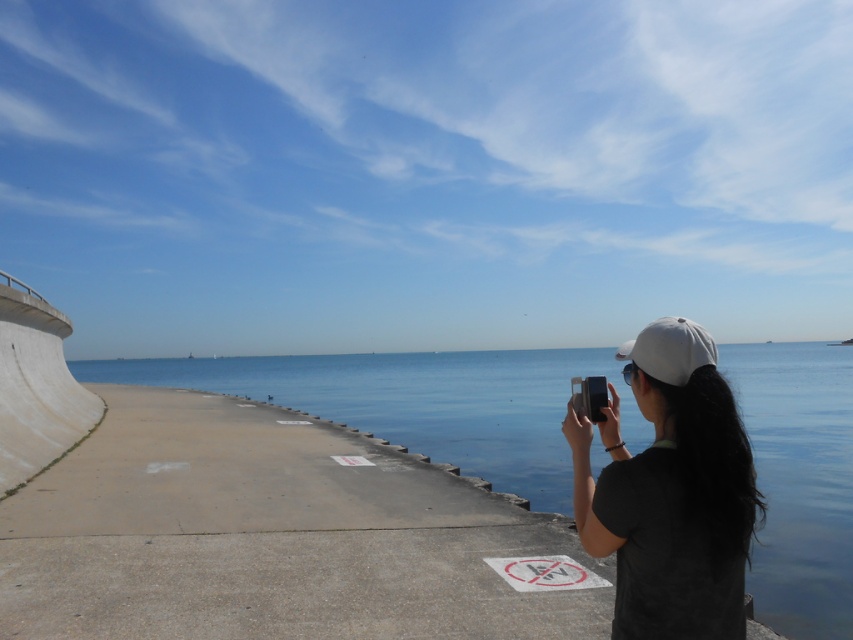
Question: Is black matte cap at upper right in front of white matte baseball hat at center?

Choices:
 (A) yes
 (B) no

Answer: (A)

Question: Does black matte cap at upper right have a lesser width compared to white matte baseball hat at center?

Choices:
 (A) no
 (B) yes

Answer: (A)

Question: Which point is farther to the camera?

Choices:
 (A) clear blue water at center
 (B) white matte baseball hat at center
 (C) black matte cap at upper right

Answer: (A)

Question: Is clear blue water at center positioned at the back of white matte baseball hat at center?

Choices:
 (A) no
 (B) yes

Answer: (B)

Question: Estimate the real-world distances between objects in this image. Which object is closer to the clear blue water at center?

Choices:
 (A) white matte baseball hat at center
 (B) black matte cap at upper right

Answer: (B)

Question: Which point is closer to the camera?

Choices:
 (A) (666, 374)
 (B) (631, 390)
 (C) (538, 445)

Answer: (A)